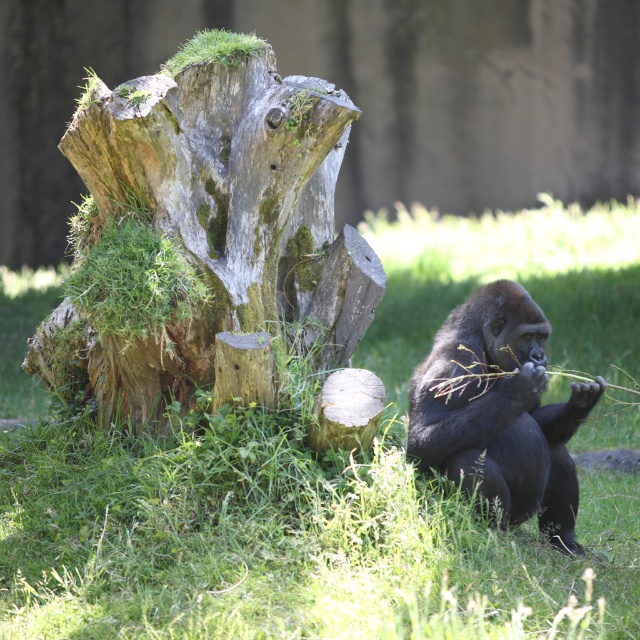
Question: Which of the following is the closest to the observer?

Choices:
 (A) black fur ape at lower right
 (B) green grass at center
 (C) weathered wood stump at center

Answer: (B)

Question: Observing the image, what is the correct spatial positioning of green grass at center in reference to black fur ape at lower right?

Choices:
 (A) below
 (B) above

Answer: (B)

Question: Can you confirm if green grass at center is positioned above weathered wood stump at center?

Choices:
 (A) no
 (B) yes

Answer: (A)

Question: Which point is closer to the camera?

Choices:
 (A) [x=445, y=470]
 (B) [x=294, y=260]

Answer: (A)

Question: Can you confirm if green grass at center is positioned above black fur ape at lower right?

Choices:
 (A) no
 (B) yes

Answer: (B)

Question: Estimate the real-world distances between objects in this image. Which object is closer to the black fur ape at lower right?

Choices:
 (A) green grass at center
 (B) weathered wood stump at center

Answer: (B)